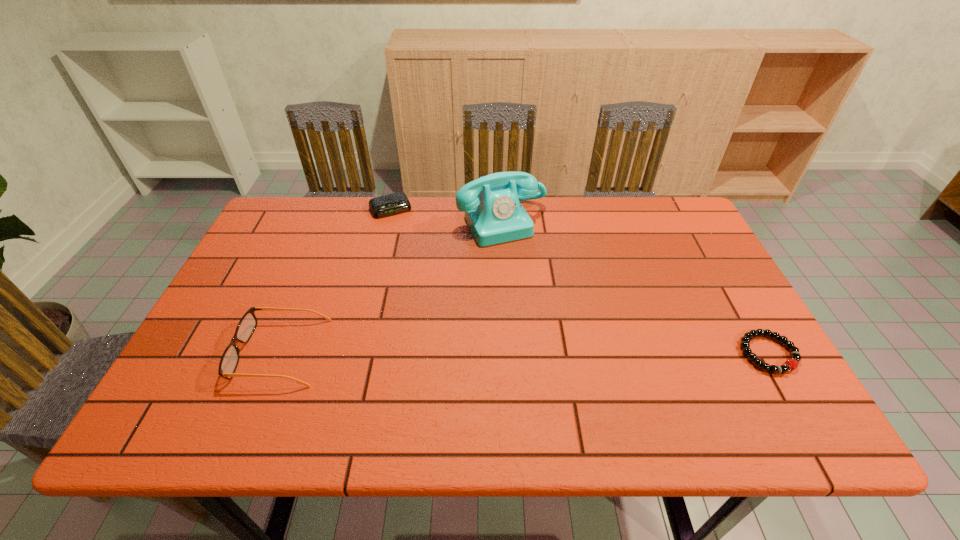
Find the location of `the third shortest object`. the third shortest object is located at coordinates (229, 361).

I want to click on the leftmost object, so click(229, 361).

This screenshot has width=960, height=540. In order to click on the shortest object in this screenshot , I will do `click(791, 364)`.

What are the coordinates of `bracelet` in the screenshot? It's located at (791, 364).

Locate an element on the screen. The width and height of the screenshot is (960, 540). the third object from left to right is located at coordinates (493, 212).

Find the location of a particular element. telephone is located at coordinates (493, 212).

Identify the location of the third object from right to left. The height and width of the screenshot is (540, 960). (391, 204).

Find the location of a particular element. the second shortest object is located at coordinates 391,204.

Find the location of a particular element. This screenshot has height=540, width=960. free point located on the front-facing side of the leftmost object is located at coordinates click(x=191, y=352).

The height and width of the screenshot is (540, 960). I want to click on blank space located 0.060m on the front-facing side of the leftmost object, so [x=213, y=352].